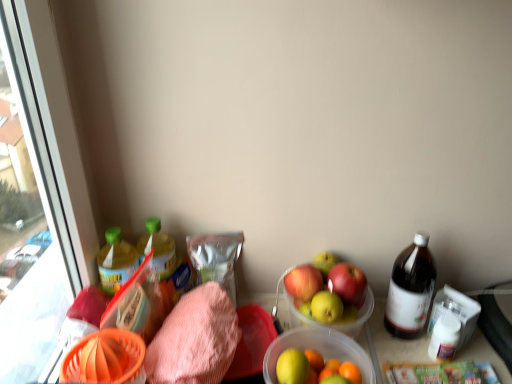
The image size is (512, 384). I want to click on free point above pink terry cloth towel at lower left (from a real-world perspective), so click(x=197, y=331).